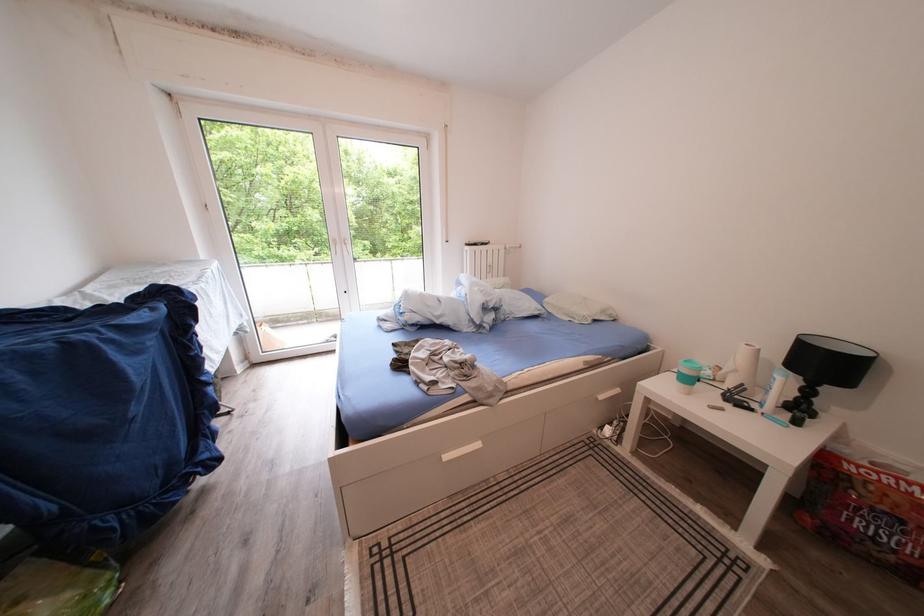
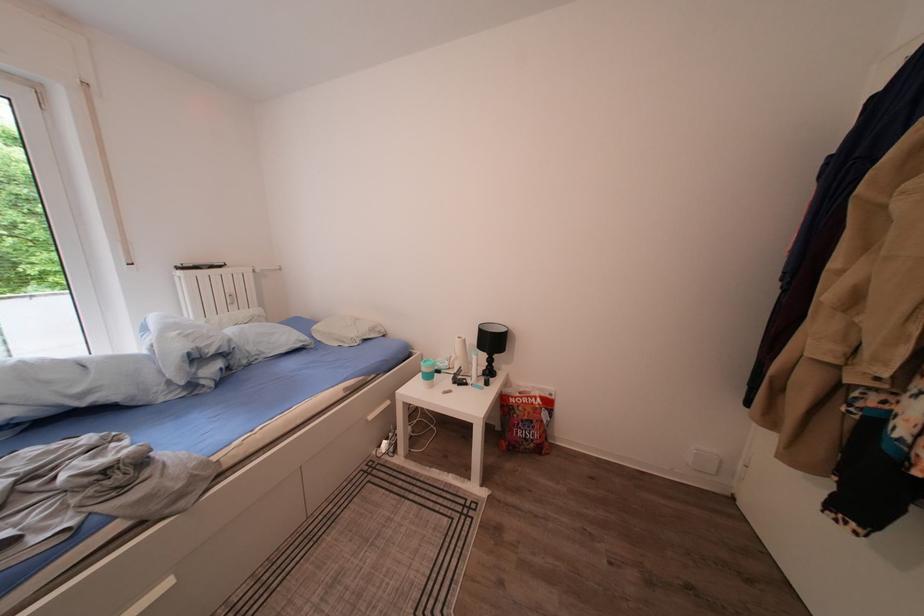
In the second image, find the point that corresponds to (x=745, y=377) in the first image.

(466, 363)